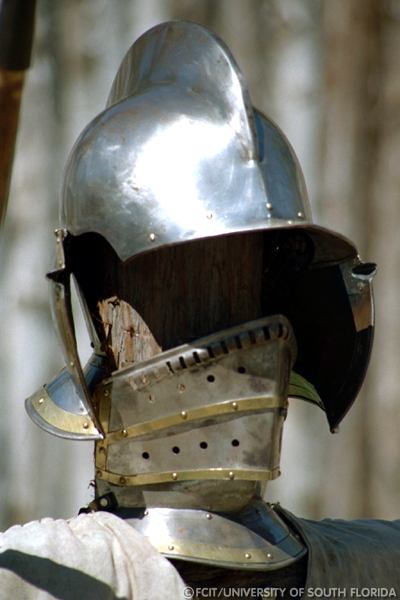
The image size is (400, 600). Find the location of `vent`. vent is located at coordinates pos(210,355).